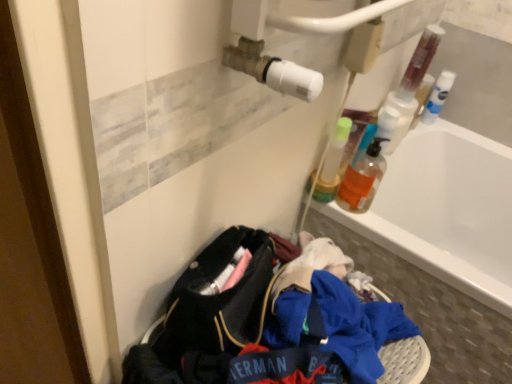
Find the location of `translucent plastic bottle at upper right, the second bottle from the back`. translucent plastic bottle at upper right, the second bottle from the back is located at coordinates (331, 164).

This screenshot has height=384, width=512. What do you see at coordinates (446, 210) in the screenshot?
I see `white glossy bathtub at upper right` at bounding box center [446, 210].

Describe the element at coordinates (355, 133) in the screenshot. The width and height of the screenshot is (512, 384). I see `translucent plastic bottle at upper right` at that location.

You are a GUI agent. You are given a task and a screenshot of the screen. Output one action in this format:
    pyautogui.click(x=<x>, y=<y>)
    Task: Click on the translucent plastic bottle at upper right, the second bottle from the back
    The image size is (512, 384).
    Given the screenshot: What is the action you would take?
    pyautogui.click(x=331, y=164)

Between point (318, 193) and point (361, 210), which one is positioned behind?

The point (318, 193) is behind.

Could you measure the distance between translucent plastic bottle at upper right, which appears as the 3th bottle when viewed from the right, and translucent orange liquid at upper right, which is the second bottle in right-to-left order?

translucent plastic bottle at upper right, which appears as the 3th bottle when viewed from the right, and translucent orange liquid at upper right, which is the second bottle in right-to-left order, are 2.13 inches apart.

Is translucent orange liquid at upper right, acting as the 1th bottle starting from the front, a part of translucent plastic bottle at upper right, which is counted as the first bottle, starting from the left?

That's incorrect, translucent orange liquid at upper right, acting as the 1th bottle starting from the front, is not inside translucent plastic bottle at upper right, which is counted as the first bottle, starting from the left.

There is a translucent plastic bottle at upper right, which is counted as the 2th bottle, starting from the front. Identify the location of the 2nd bottle below it (from a real-world perspective). (362, 178).

Which of these two, white glossy bathtub at upper right or translucent plastic bottle at upper right, which is counted as the first bottle, starting from the left, stands taller?

white glossy bathtub at upper right is taller.

Choose the correct answer: Is white glossy bathtub at upper right inside translucent plastic bottle at upper right, which is counted as the 2th bottle, starting from the front, or outside it?

white glossy bathtub at upper right is located beyond the bounds of translucent plastic bottle at upper right, which is counted as the 2th bottle, starting from the front.

Can you confirm if white glossy bathtub at upper right is smaller than translucent plastic bottle at upper right, which is counted as the first bottle, starting from the left?

Incorrect, white glossy bathtub at upper right is not smaller in size than translucent plastic bottle at upper right, which is counted as the first bottle, starting from the left.

Could you tell me if white glossy bathtub at upper right is turned towards translucent plastic bottle at upper right, which appears as the 3th bottle when viewed from the right?

No, white glossy bathtub at upper right is not turned towards translucent plastic bottle at upper right, which appears as the 3th bottle when viewed from the right.

Is white plastic bottle at upper right, which is the third bottle from left to right, completely or partially outside of translucent orange liquid at upper right, the second bottle when ordered from left to right?

Absolutely, white plastic bottle at upper right, which is the third bottle from left to right, is external to translucent orange liquid at upper right, the second bottle when ordered from left to right.

What's the angular difference between white plastic bottle at upper right, which is the first bottle in right-to-left order, and translucent orange liquid at upper right, acting as the 1th bottle starting from the front,'s facing directions?

The facing directions of white plastic bottle at upper right, which is the first bottle in right-to-left order, and translucent orange liquid at upper right, acting as the 1th bottle starting from the front, are 0.00436 degrees apart.

Find the location of a particular element. Image resolution: width=512 pixels, height=384 pixels. the 1st bottle to the left of the white plastic bottle at upper right, which is counted as the first bottle, starting from the back, counting from the anchor's position is located at coordinates (362, 178).

Considering the sizes of objects white glossy bathtub at upper right and white plastic bottle at upper right, which is counted as the first bottle, starting from the back, in the image provided, who is taller, white glossy bathtub at upper right or white plastic bottle at upper right, which is counted as the first bottle, starting from the back,?

With more height is white glossy bathtub at upper right.

Is white glossy bathtub at upper right positioned with its back to white plastic bottle at upper right, which is the third bottle from left to right?

white glossy bathtub at upper right is not turned away from white plastic bottle at upper right, which is the third bottle from left to right.

Where is `bottle that is the 2nd object above the white glossy bathtub at upper right (from a real-world perspective)`? bottle that is the 2nd object above the white glossy bathtub at upper right (from a real-world perspective) is located at coordinates (438, 96).

From a real-world perspective, is white glossy bathtub at upper right positioned above or below white plastic bottle at upper right, which is the first bottle in right-to-left order?

Clearly, from a real-world perspective, white glossy bathtub at upper right is below white plastic bottle at upper right, which is the first bottle in right-to-left order.

From a real-world perspective, is white glossy bathtub at upper right above or below translucent plastic bottle at upper right?

From a real-world perspective, white glossy bathtub at upper right is physically below translucent plastic bottle at upper right.

Is white glossy bathtub at upper right next to translucent plastic bottle at upper right?

white glossy bathtub at upper right and translucent plastic bottle at upper right are clearly separated.

Is white glossy bathtub at upper right oriented away from translucent plastic bottle at upper right?

No, white glossy bathtub at upper right is not facing the opposite direction of translucent plastic bottle at upper right.

Locate an element on the screen. mouthwash beneath the white plastic bottle at upper right, which is the third bottle from left to right (from a real-world perspective) is located at coordinates (355, 133).

Who is taller, white plastic bottle at upper right, which is counted as the first bottle, starting from the back, or translucent plastic bottle at upper right?

white plastic bottle at upper right, which is counted as the first bottle, starting from the back.

Is white plastic bottle at upper right, which is the first bottle in right-to-left order, situated inside translucent plastic bottle at upper right or outside?

white plastic bottle at upper right, which is the first bottle in right-to-left order, is spatially situated outside translucent plastic bottle at upper right.

From a real-world perspective, is white plastic bottle at upper right, which is counted as the first bottle, starting from the back, positioned above or below translucent plastic bottle at upper right?

white plastic bottle at upper right, which is counted as the first bottle, starting from the back, is situated higher than translucent plastic bottle at upper right in the real world.

Which of these two, translucent orange liquid at upper right, acting as the 1th bottle starting from the front, or translucent plastic bottle at upper right, is smaller?

translucent plastic bottle at upper right is smaller.

Is translucent orange liquid at upper right, which is the second bottle in right-to-left order, directly adjacent to translucent plastic bottle at upper right?

Yes, translucent orange liquid at upper right, which is the second bottle in right-to-left order, is beside translucent plastic bottle at upper right.

Is point (347, 174) closer to viewer compared to point (348, 149)?

No, it is behind (348, 149).

Identify the location of bottle below the translucent plastic bottle at upper right, the second bottle from the back (from the image's perspective). The width and height of the screenshot is (512, 384). (362, 178).

Locate an element on the screen. Image resolution: width=512 pixels, height=384 pixels. bathtub located in front of the translucent plastic bottle at upper right, which is counted as the 2th bottle, starting from the front is located at coordinates (446, 210).

Which object lies further to the anchor point white glossy bathtub at upper right, translucent plastic bottle at upper right or translucent orange liquid at upper right, which ranks as the third bottle in back-to-front order?

Based on the image, translucent plastic bottle at upper right appears to be further to white glossy bathtub at upper right.

Estimate the real-world distances between objects in this image. Which object is closer to translucent plastic bottle at upper right, the second bottle from the back, translucent orange liquid at upper right, which ranks as the third bottle in back-to-front order, or translucent plastic bottle at upper right?

translucent plastic bottle at upper right.

In the scene shown: From the image, which object appears to be farther from white plastic bottle at upper right, which is the first bottle in right-to-left order, translucent plastic bottle at upper right or translucent orange liquid at upper right, the second bottle when ordered from left to right?

The object further to white plastic bottle at upper right, which is the first bottle in right-to-left order, is translucent orange liquid at upper right, the second bottle when ordered from left to right.

Estimate the real-world distances between objects in this image. Which object is further from translucent orange liquid at upper right, which ranks as the third bottle in back-to-front order, white glossy bathtub at upper right or translucent plastic bottle at upper right, which is counted as the first bottle, starting from the left?

white glossy bathtub at upper right lies further to translucent orange liquid at upper right, which ranks as the third bottle in back-to-front order, than the other object.

Looking at this image, considering their positions, is white plastic bottle at upper right, which is the third bottle from left to right, positioned further to translucent plastic bottle at upper right than translucent plastic bottle at upper right, which is counted as the 2th bottle, starting from the front?

white plastic bottle at upper right, which is the third bottle from left to right, lies further to translucent plastic bottle at upper right than the other object.

Considering their positions, is white plastic bottle at upper right, which is the 3th bottle from front to back, positioned further to translucent plastic bottle at upper right, which appears as the 3th bottle when viewed from the right, than translucent orange liquid at upper right, acting as the 1th bottle starting from the front?

white plastic bottle at upper right, which is the 3th bottle from front to back, is further to translucent plastic bottle at upper right, which appears as the 3th bottle when viewed from the right.

From the image, which object appears to be farther from white plastic bottle at upper right, which is the first bottle in right-to-left order, translucent plastic bottle at upper right or translucent plastic bottle at upper right, the second bottle from the back?

translucent plastic bottle at upper right, the second bottle from the back, lies further to white plastic bottle at upper right, which is the first bottle in right-to-left order, than the other object.

Which object lies nearer to the anchor point translucent plastic bottle at upper right, which is counted as the 2th bottle, starting from the front, translucent orange liquid at upper right, which is the second bottle in right-to-left order, or white glossy bathtub at upper right?

translucent orange liquid at upper right, which is the second bottle in right-to-left order, lies closer to translucent plastic bottle at upper right, which is counted as the 2th bottle, starting from the front, than the other object.

Where is `bottle located between translucent orange liquid at upper right, the second bottle when ordered from left to right, and translucent plastic bottle at upper right in the depth direction`? This screenshot has width=512, height=384. bottle located between translucent orange liquid at upper right, the second bottle when ordered from left to right, and translucent plastic bottle at upper right in the depth direction is located at coordinates (331, 164).

Image resolution: width=512 pixels, height=384 pixels. Identify the location of mouthwash located between translucent orange liquid at upper right, the second bottle when ordered from left to right, and white plastic bottle at upper right, which is the 3th bottle from front to back, in the depth direction. (355, 133).

Where is `mouthwash between translucent plastic bottle at upper right, which appears as the 3th bottle when viewed from the right, and white plastic bottle at upper right, which is the third bottle from left to right, in the horizontal direction`? The height and width of the screenshot is (384, 512). mouthwash between translucent plastic bottle at upper right, which appears as the 3th bottle when viewed from the right, and white plastic bottle at upper right, which is the third bottle from left to right, in the horizontal direction is located at coordinates (355, 133).

Identify the location of bottle between translucent orange liquid at upper right, the second bottle when ordered from left to right, and white plastic bottle at upper right, which is the 3th bottle from front to back, along the z-axis. coord(331,164).